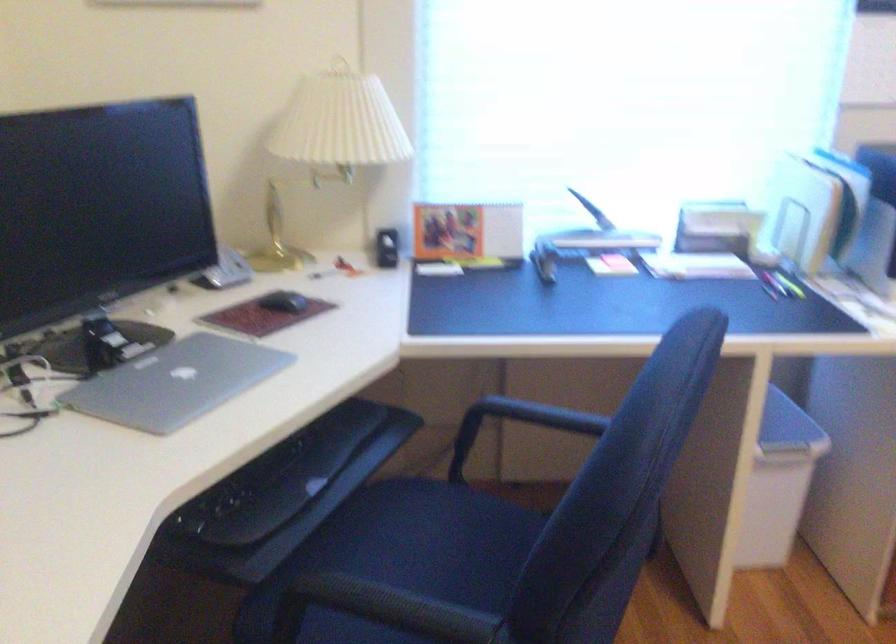
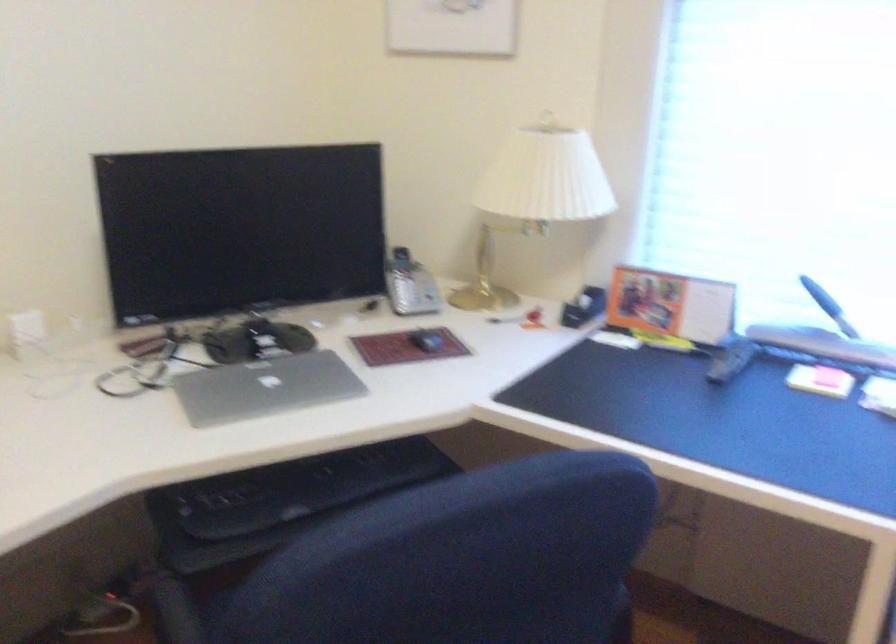
Find the pixel in the second image that matches point 288,469 in the first image.

(302, 488)